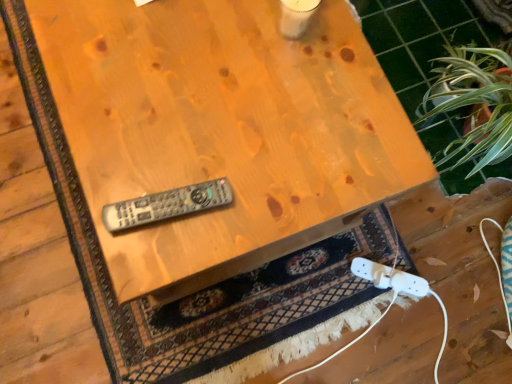
Question: In the image, is wooden remote control at center positioned in front of or behind gray plastic remote at center?

Choices:
 (A) front
 (B) behind

Answer: (A)

Question: Is point (122, 23) positioned closer to the camera than point (105, 215)?

Choices:
 (A) closer
 (B) farther

Answer: (B)

Question: Based on their relative distances, which object is nearer to the gray plastic remote at center?

Choices:
 (A) green leafy plant at upper right
 (B) wooden table at upper right
 (C) wooden remote control at center
 (D) white plastic game controller at lower right

Answer: (C)

Question: Which is farther from the green leafy plant at upper right?

Choices:
 (A) wooden table at upper right
 (B) wooden remote control at center
 (C) gray plastic remote at center
 (D) white plastic game controller at lower right

Answer: (C)